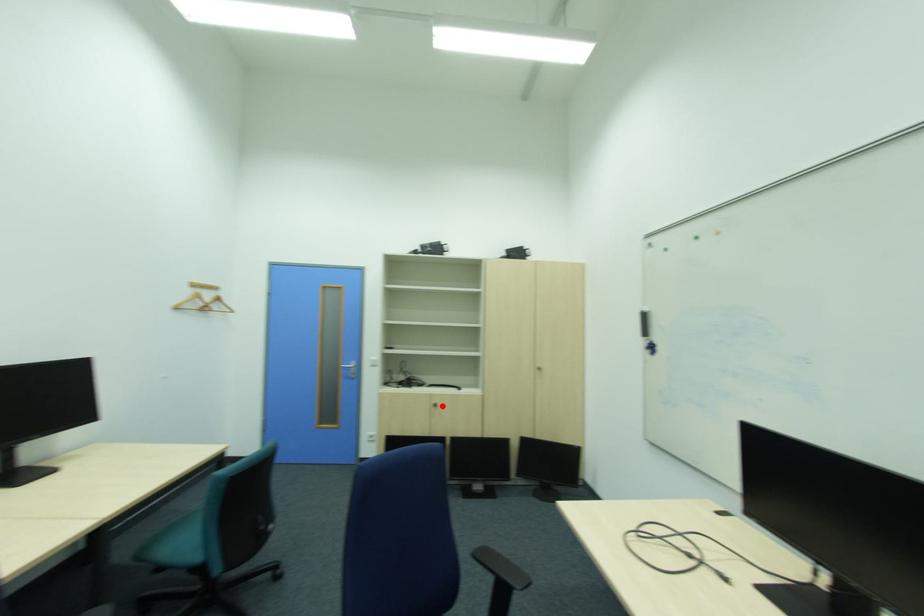
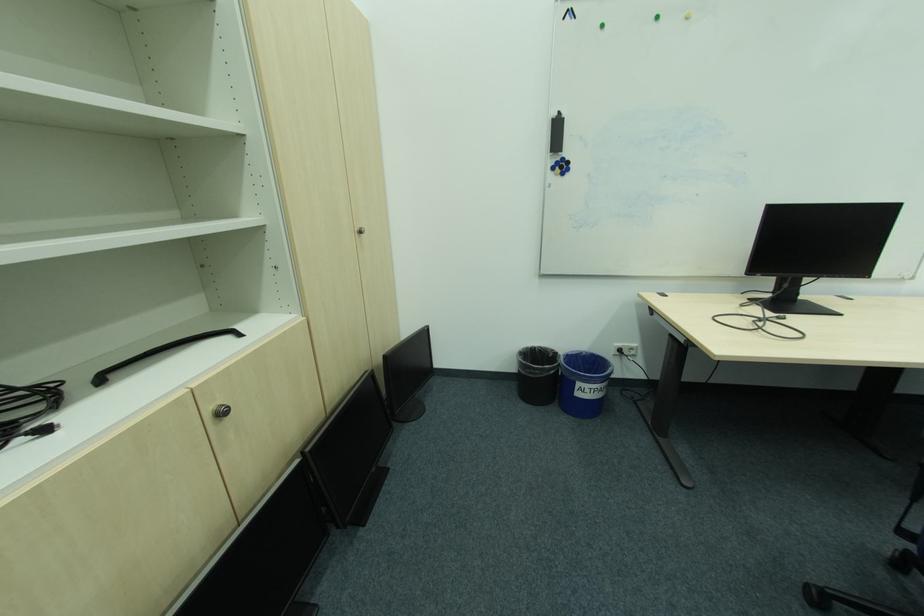
Question: A red point is marked in image1. In image2, is the corresponding 3D point closer to the camera or farther? Reply with the corresponding letter.

Choices:
 (A) The corresponding 3D point is closer.
 (B) The corresponding 3D point is farther.

Answer: (A)